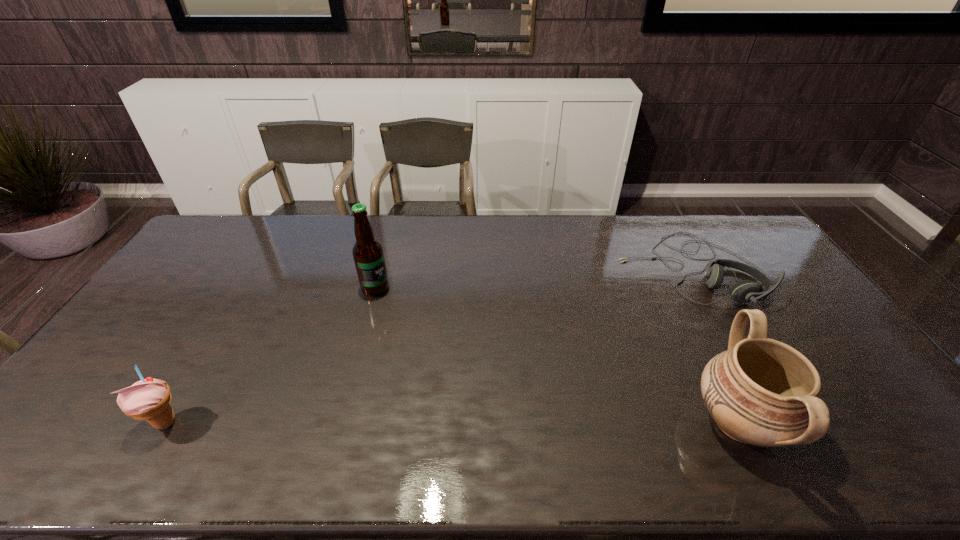
I want to click on vacant space that satisfies the following two spatial constraints: 1. on the front side of the third object from right to left; 2. on the front-facing side of the second tallest object, so click(340, 421).

You are a GUI agent. You are given a task and a screenshot of the screen. Output one action in this format:
    pyautogui.click(x=<x>, y=<y>)
    Task: Click on the vacant space that satisfies the following two spatial constraints: 1. on the back side of the third object from right to left; 2. on the left side of the second shortest object
    This screenshot has width=960, height=540.
    Given the screenshot: What is the action you would take?
    pyautogui.click(x=246, y=288)

Locate an element on the screen. The image size is (960, 540). vacant area in the image that satisfies the following two spatial constraints: 1. on the back side of the headset; 2. on the right side of the third tallest object is located at coordinates (257, 268).